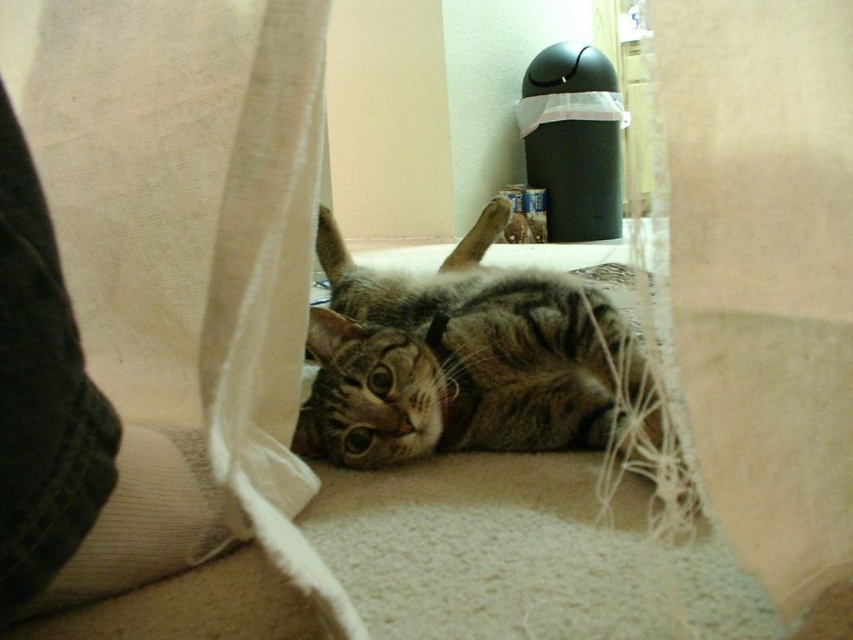
Question: Is white fabric curtain at lower left above denim at left?

Choices:
 (A) yes
 (B) no

Answer: (A)

Question: Can you confirm if tabby fur cat at center is positioned above denim at left?

Choices:
 (A) yes
 (B) no

Answer: (A)

Question: Is white fabric curtain at lower left below denim at left?

Choices:
 (A) no
 (B) yes

Answer: (A)

Question: Which of these objects is positioned closest to the tabby fur cat at center?

Choices:
 (A) white fabric curtain at lower left
 (B) denim at left

Answer: (A)

Question: Among these points, which one is farthest from the camera?

Choices:
 (A) (326, 323)
 (B) (0, 240)
 (C) (149, 538)

Answer: (A)

Question: Which of the following is the closest to the observer?

Choices:
 (A) (454, 289)
 (B) (10, 464)
 (C) (282, 1)

Answer: (B)